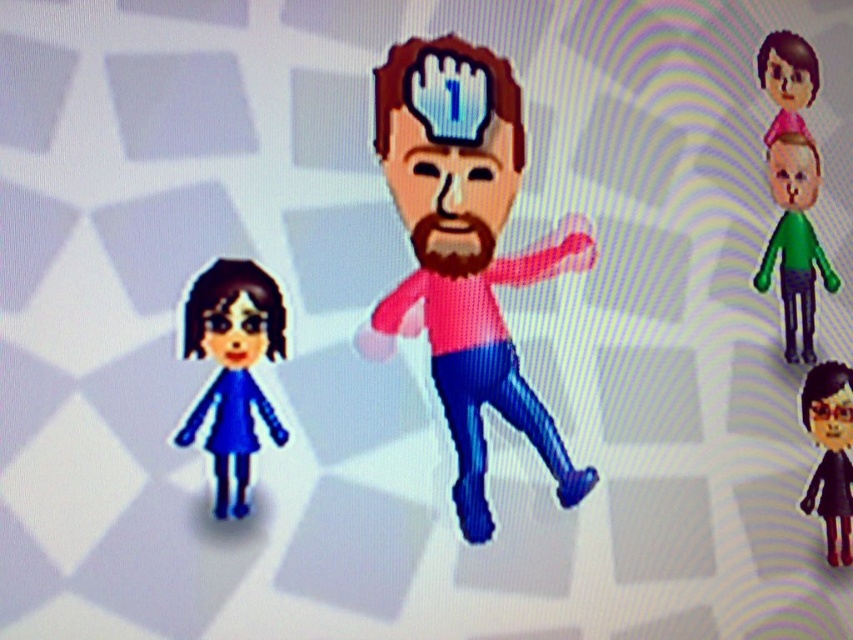
Question: Considering the relative positions of green matte toy at upper right and black matte doll at lower right in the image provided, where is green matte toy at upper right located with respect to black matte doll at lower right?

Choices:
 (A) right
 (B) left

Answer: (B)

Question: Can you confirm if black matte doll at lower right is thinner than pink glossy toy at upper right?

Choices:
 (A) no
 (B) yes

Answer: (B)

Question: Which object appears closest to the camera in this image?

Choices:
 (A) black matte doll at lower right
 (B) pink glossy toy at upper right

Answer: (A)

Question: Is pink matte toy at center thinner than blue matte doll at lower left?

Choices:
 (A) no
 (B) yes

Answer: (A)

Question: Which of the following is the farthest from the observer?

Choices:
 (A) (808, 140)
 (B) (779, 253)

Answer: (A)

Question: Which of the following is the farthest from the observer?

Choices:
 (A) (799, 243)
 (B) (761, 45)

Answer: (B)